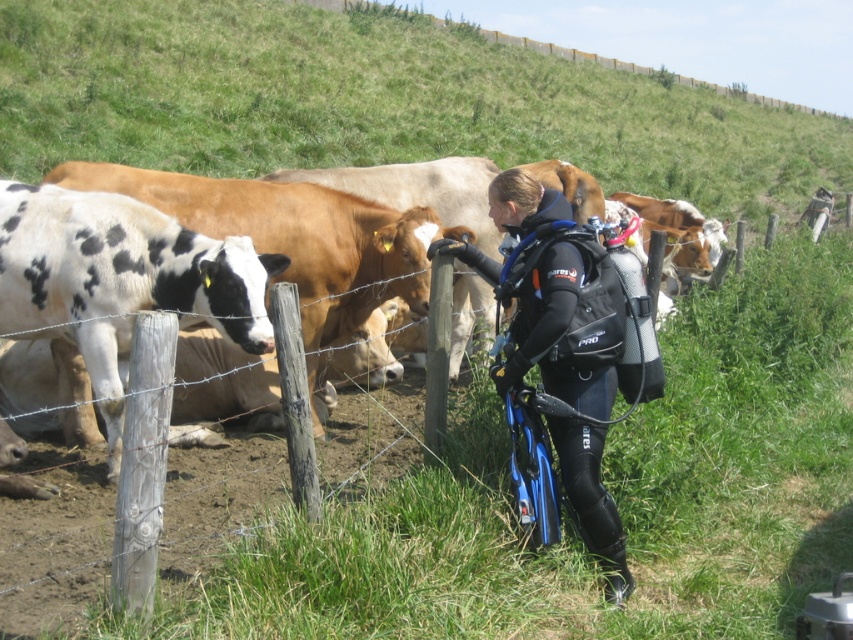
You are a photographer trying to capture a photo of the wooden post at center and the black neoprene wetsuit at center. If you want to frame them both in the shot, which object should you position closer to the left side of the camera frame?

The wooden post at center should be positioned closer to the left side of the camera frame because it is already to the left of the black neoprene wetsuit at center.

You are a photographer trying to capture a unique shot of the wooden post at center and the black neoprene wetsuit at center. Since you want to emphasize the size difference between them, which object should you focus on to highlight the contrast?

The wooden post at center is smaller than the black neoprene wetsuit at center, so focusing on the wooden post at center would emphasize its smaller size compared to the larger black neoprene wetsuit at center.